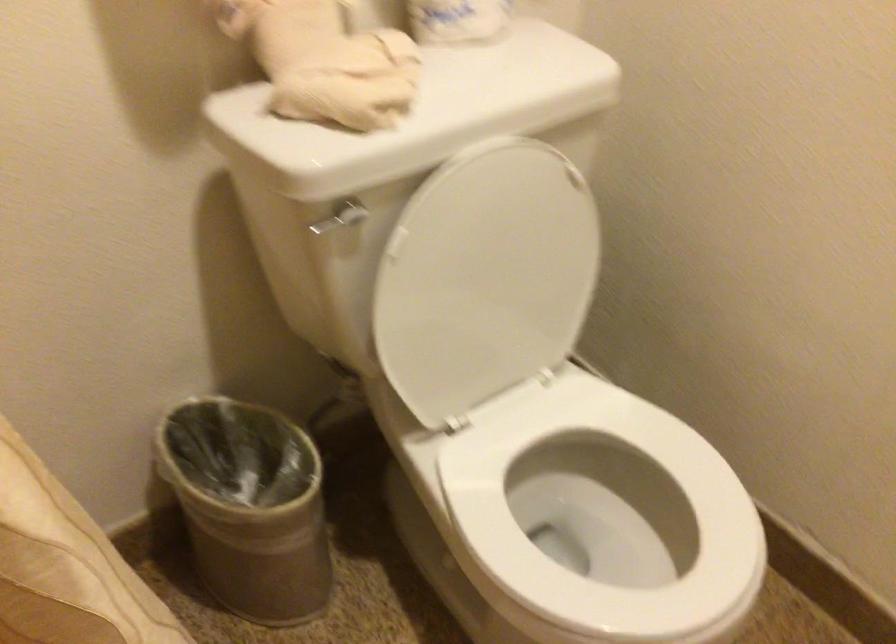
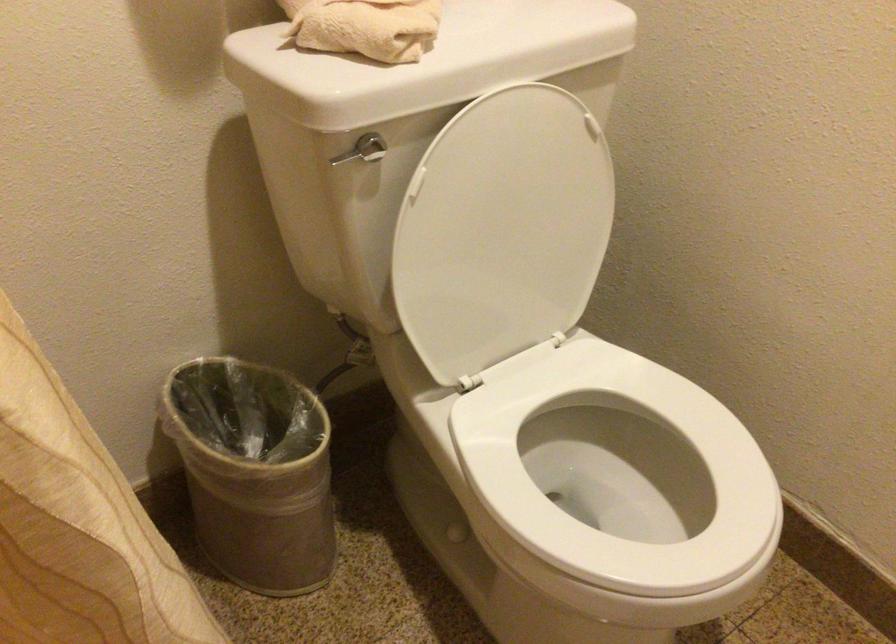
Where in the second image is the point corresponding to the point at 341,93 from the first image?

(365, 26)